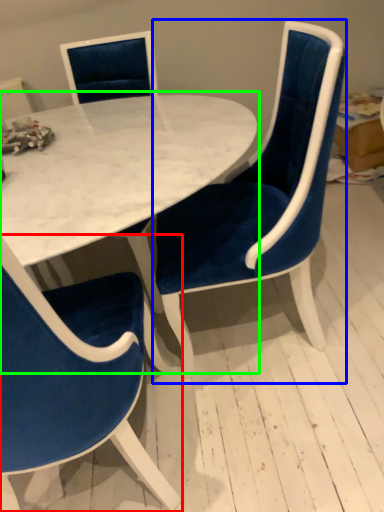
Question: Which object is positioned farthest from chair (highlighted by a red box)? Select from chair (highlighted by a blue box) and table (highlighted by a green box).

Choices:
 (A) chair
 (B) table

Answer: (A)